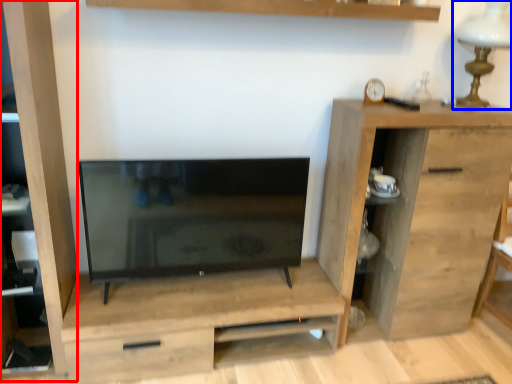
Question: Among these objects, which one is farthest to the camera, cabinet (highlighted by a red box) or table lamp (highlighted by a blue box)?

Choices:
 (A) cabinet
 (B) table lamp

Answer: (B)